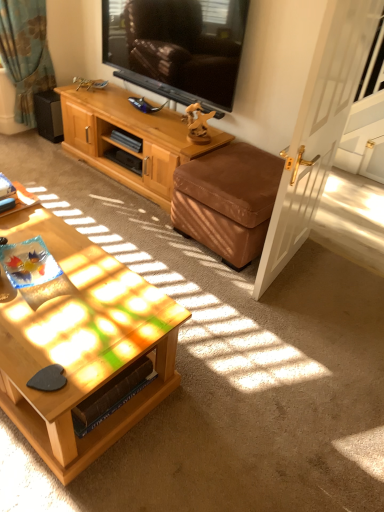
Locate an element on the screen. Image resolution: width=384 pixels, height=512 pixels. vacant point to the left of light brown wood cabinet at upper center is located at coordinates (57, 165).